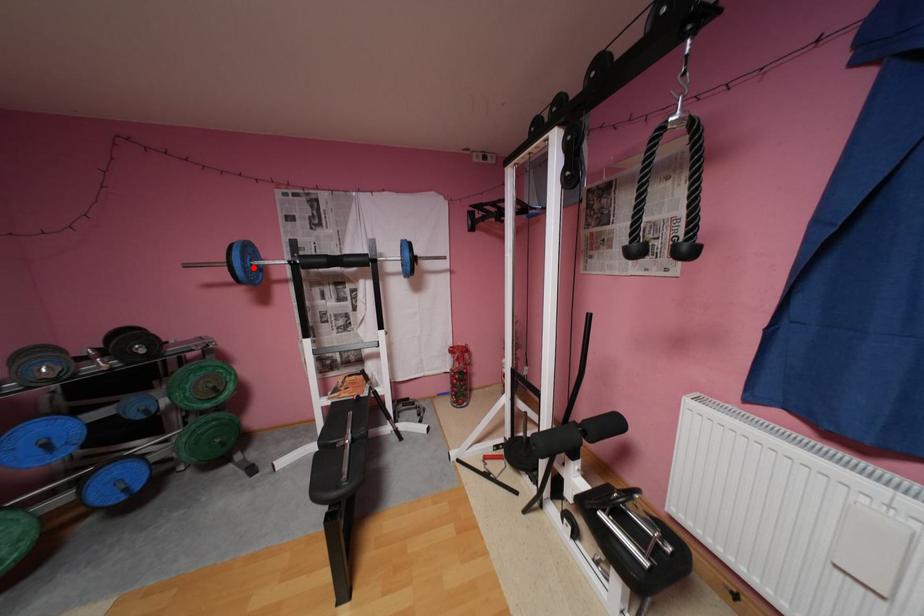
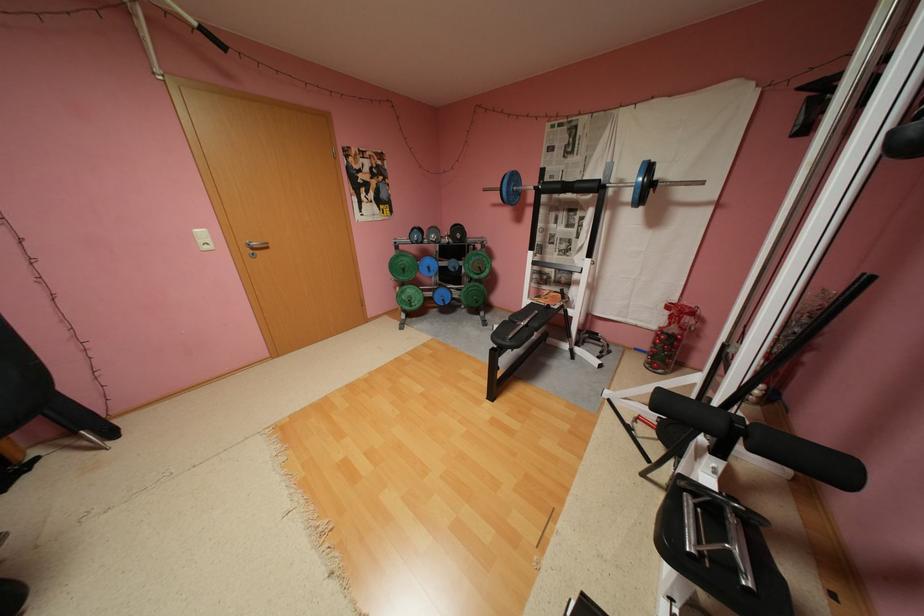
Question: A red point is marked in image1. In image2, is the corresponding 3D point closer to the camera or farther? Reply with the corresponding letter.

Choices:
 (A) The corresponding 3D point is closer.
 (B) The corresponding 3D point is farther.

Answer: (A)